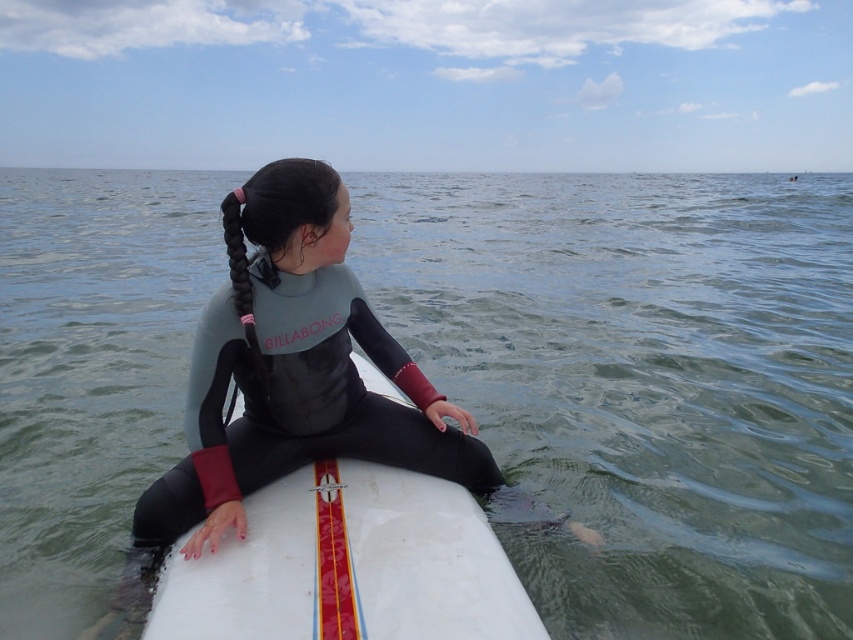
Question: Is white smooth surfboard at center below gray matte wetsuit at center?

Choices:
 (A) no
 (B) yes

Answer: (B)

Question: Is clear water at surfboard center positioned behind white smooth surfboard at center?

Choices:
 (A) no
 (B) yes

Answer: (B)

Question: Which of these objects is positioned closest to the white smooth surfboard at center?

Choices:
 (A) clear water at surfboard center
 (B) gray matte wetsuit at center

Answer: (B)

Question: Which point appears closest to the camera in this image?

Choices:
 (A) (631, 624)
 (B) (224, 465)
 (C) (200, 593)

Answer: (C)

Question: Which object is farther from the camera taking this photo?

Choices:
 (A) white smooth surfboard at center
 (B) clear water at surfboard center
 (C) gray matte wetsuit at center

Answer: (B)

Question: Can you confirm if clear water at surfboard center is positioned to the right of gray matte wetsuit at center?

Choices:
 (A) no
 (B) yes

Answer: (A)